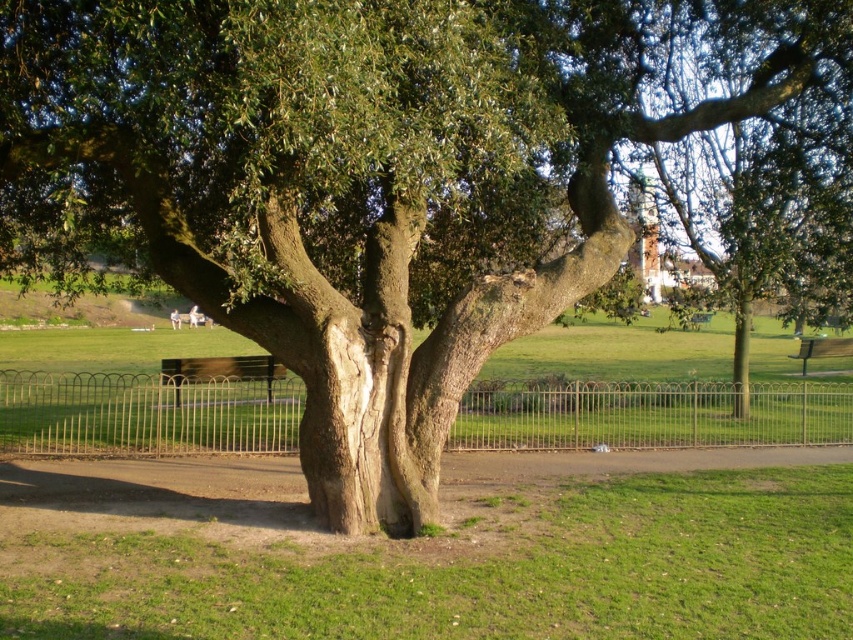
You are planning to place a picnic blanket between the metallic silver fence at center and the wooden park bench at lower right. Given that the distance between them is 15.39 meters, can you estimate how much space there is for the blanket if it requires 5 meters of clear space?

The metallic silver fence at center and wooden park bench at lower right are 15.39 meters apart, so there is sufficient space for the picnic blanket requiring 5 meters of clear space between them.